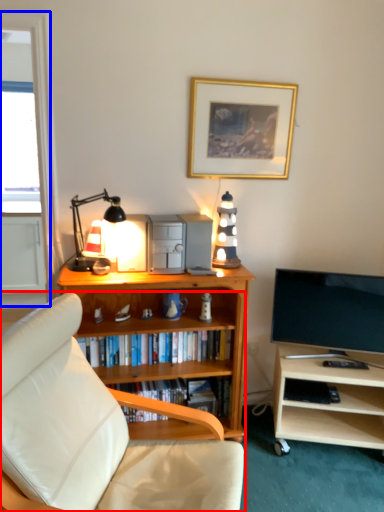
Question: Which point is closer to the camera, studio couch (highlighted by a red box) or glass door (highlighted by a blue box)?

Choices:
 (A) studio couch
 (B) glass door

Answer: (A)